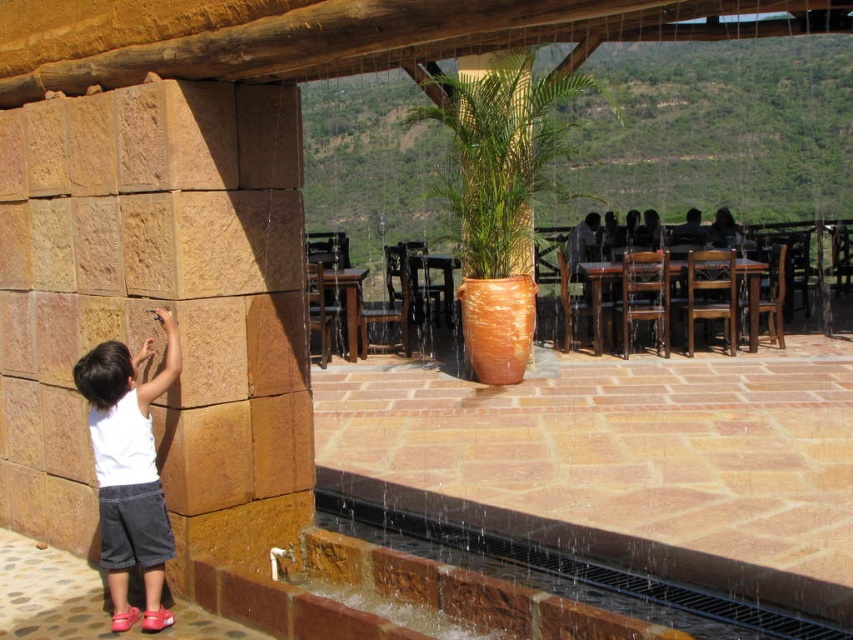
Question: Which object is positioned closest to the white cotton shirt at left?

Choices:
 (A) terracotta clay pot at center
 (B) brown stone wall at left

Answer: (B)

Question: Is brown stone wall at left positioned in front of terracotta clay pot at center?

Choices:
 (A) no
 (B) yes

Answer: (B)

Question: Which of the following is the closest to the observer?

Choices:
 (A) (253, 534)
 (B) (467, 72)

Answer: (A)

Question: Where is white cotton shirt at left located in relation to terracotta clay pot at center in the image?

Choices:
 (A) left
 (B) right

Answer: (A)

Question: Which object is positioned closest to the brown stone wall at left?

Choices:
 (A) terracotta clay pot at center
 (B) white cotton shirt at left

Answer: (B)

Question: Can you confirm if brown stone wall at left is positioned above white cotton shirt at left?

Choices:
 (A) no
 (B) yes

Answer: (B)